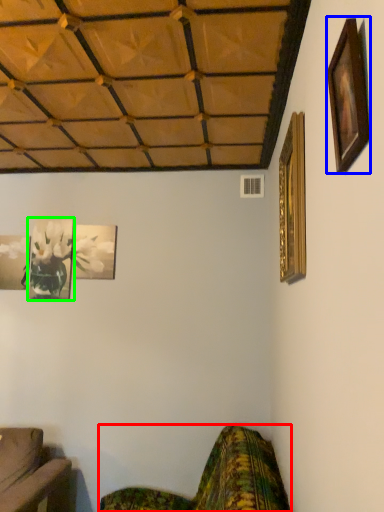
Question: Considering the real-world distances, which object is closest to studio couch (highlighted by a red box)? picture frame (highlighted by a blue box) or picture frame (highlighted by a green box).

Choices:
 (A) picture frame
 (B) picture frame

Answer: (A)